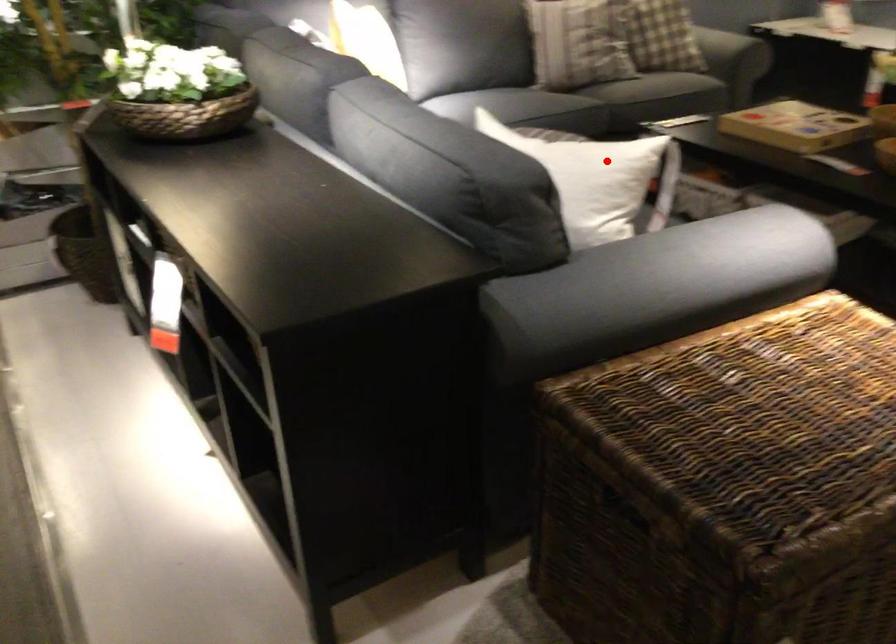
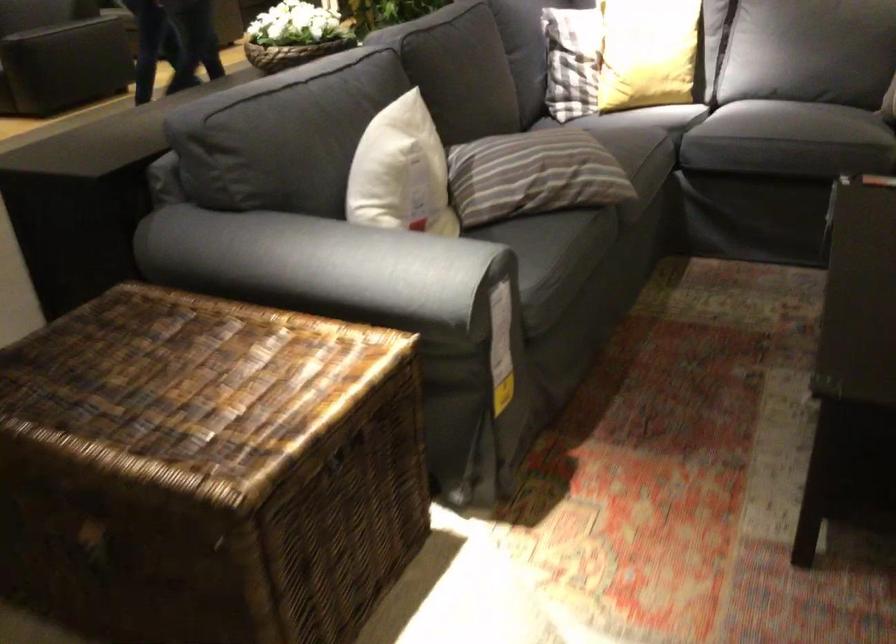
In the second image, find the point that corresponds to the highlighted location in the first image.

(401, 172)